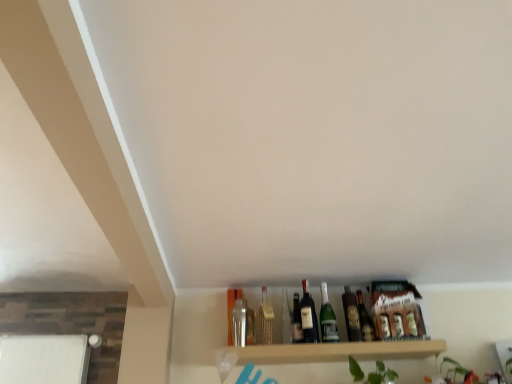
Question: Considering the relative sizes of matte glass bottle at center, the 3th bottle when ordered from right to left, and matte glass beer bottle at center, acting as the first beer bottle starting from the left, in the image provided, is matte glass bottle at center, the 3th bottle when ordered from right to left, taller than matte glass beer bottle at center, acting as the first beer bottle starting from the left,?

Choices:
 (A) no
 (B) yes

Answer: (A)

Question: Does matte glass bottle at center, the 3th bottle when ordered from right to left, turn towards matte glass beer bottle at center, placed as the 2th beer bottle when sorted from right to left?

Choices:
 (A) no
 (B) yes

Answer: (A)

Question: Can you confirm if matte glass bottle at center, the 3th bottle when ordered from right to left, is positioned to the left of matte glass beer bottle at center, placed as the 2th beer bottle when sorted from right to left?

Choices:
 (A) no
 (B) yes

Answer: (B)

Question: From a real-world perspective, is matte glass bottle at center, which ranks as the second bottle in left-to-right order, physically above matte glass beer bottle at center, placed as the 2th beer bottle when sorted from right to left?

Choices:
 (A) no
 (B) yes

Answer: (A)

Question: Does matte glass bottle at center, which ranks as the second bottle in left-to-right order, have a smaller size compared to matte glass beer bottle at center, acting as the first beer bottle starting from the left?

Choices:
 (A) yes
 (B) no

Answer: (A)

Question: Is matte glass bottle at center, which ranks as the second bottle in left-to-right order, beside matte glass beer bottle at center, acting as the first beer bottle starting from the left?

Choices:
 (A) yes
 (B) no

Answer: (A)

Question: From a real-world perspective, is clear glass wine bottle at center located higher than matte glass bottle at center, which ranks as the second bottle in left-to-right order?

Choices:
 (A) no
 (B) yes

Answer: (B)

Question: From the image's perspective, is clear glass wine bottle at center below matte glass bottle at center, the 3th bottle when ordered from right to left?

Choices:
 (A) no
 (B) yes

Answer: (A)

Question: Does clear glass wine bottle at center lie in front of matte glass bottle at center, the 3th bottle when ordered from right to left?

Choices:
 (A) yes
 (B) no

Answer: (A)

Question: Does clear glass wine bottle at center have a larger size compared to matte glass bottle at center, the 3th bottle when ordered from right to left?

Choices:
 (A) no
 (B) yes

Answer: (B)

Question: Are clear glass wine bottle at center and matte glass bottle at center, the 3th bottle when ordered from right to left, located far from each other?

Choices:
 (A) no
 (B) yes

Answer: (A)

Question: From a real-world perspective, does clear glass wine bottle at center sit lower than matte glass bottle at center, the 3th bottle when ordered from right to left?

Choices:
 (A) no
 (B) yes

Answer: (A)

Question: Is matte glass beer bottle at center, which appears as the first beer bottle when viewed from the right, located outside matte glass bottle at center, the 3th bottle when ordered from right to left?

Choices:
 (A) yes
 (B) no

Answer: (A)